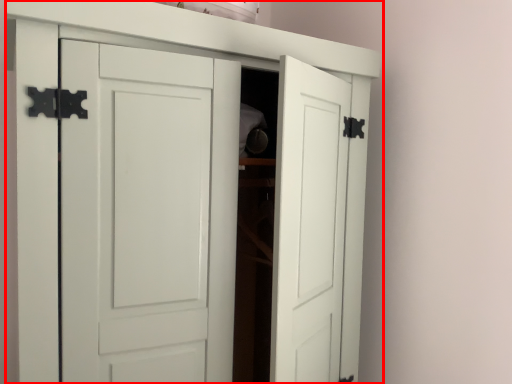
Question: From the image's perspective, where is cupboard (annotated by the red box) located in relation to shelf in the image?

Choices:
 (A) below
 (B) above

Answer: (A)